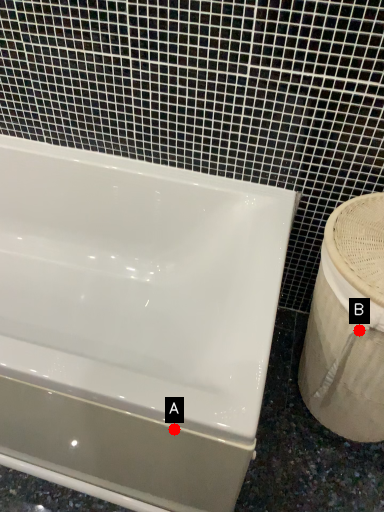
Question: Two points are circled on the image, labeled by A and B beside each circle. Which point is farther from the camera taking this photo?

Choices:
 (A) A is further
 (B) B is further

Answer: (B)